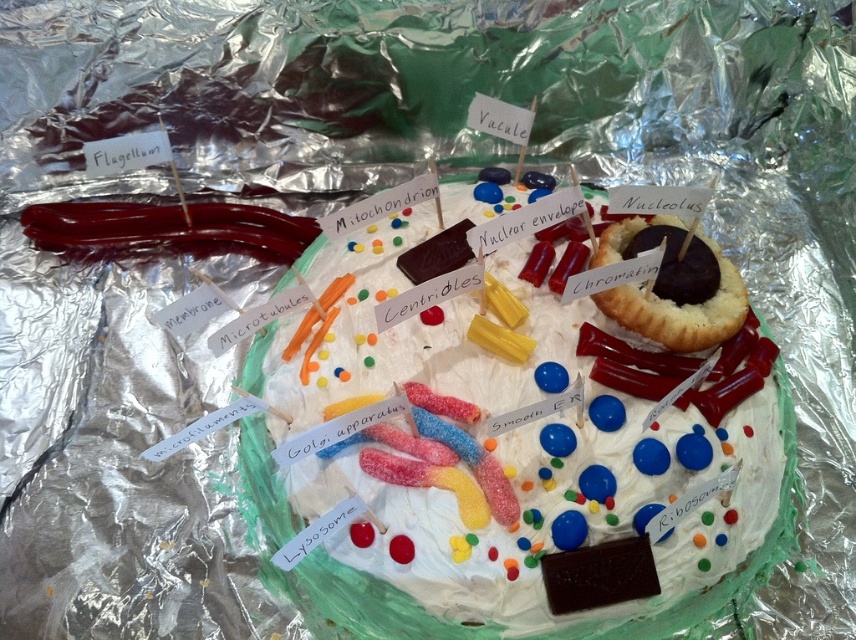
Who is more distant from viewer, (522,608) or (681,225)?

Positioned behind is point (681,225).

Which of these two, smooth chocolate cake at center or chocolate cake at upper right, stands taller?

With more height is smooth chocolate cake at center.

Identify the location of smooth chocolate cake at center. (495, 461).